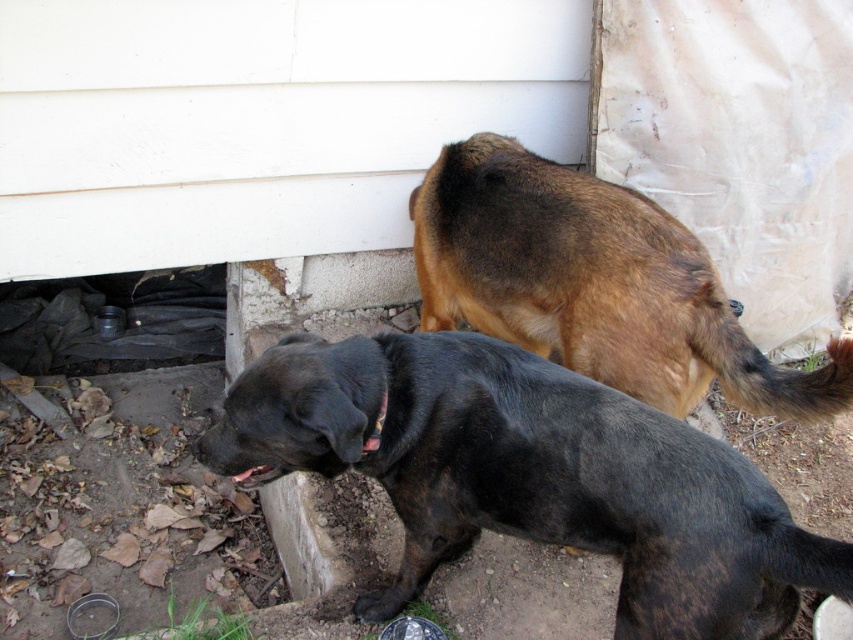
Does black matte dog at lower center have a lesser width compared to brown furry dog at upper right?

In fact, black matte dog at lower center might be wider than brown furry dog at upper right.

Does black matte dog at lower center appear under brown furry dog at upper right?

Correct, black matte dog at lower center is located below brown furry dog at upper right.

Measure the distance between point (668, 460) and camera.

Point (668, 460) is 4.90 feet away from camera.

At what (x,y) coordinates should I click in order to perform the action: click on black matte dog at lower center. Please return your answer as a coordinate pair (x, y). The width and height of the screenshot is (853, 640). Looking at the image, I should click on (531, 476).

Between black matte dog at lower center and black fabric neckband at lower center, which one has more height?

black matte dog at lower center

Which is above, black matte dog at lower center or black fabric neckband at lower center?

Positioned higher is black fabric neckband at lower center.

Is point (758, 550) positioned after point (387, 397)?

No, it is not.

Find the location of a particular element. The height and width of the screenshot is (640, 853). black matte dog at lower center is located at coordinates (531, 476).

Between brown furry dog at upper right and black fabric neckband at lower center, which one is positioned higher?

Positioned higher is brown furry dog at upper right.

Is point (654, 397) in front of point (375, 442)?

That is False.

Is point (599, 314) more distant than point (380, 420)?

Yes, it is.

Where is `brown furry dog at upper right`? brown furry dog at upper right is located at coordinates (595, 284).